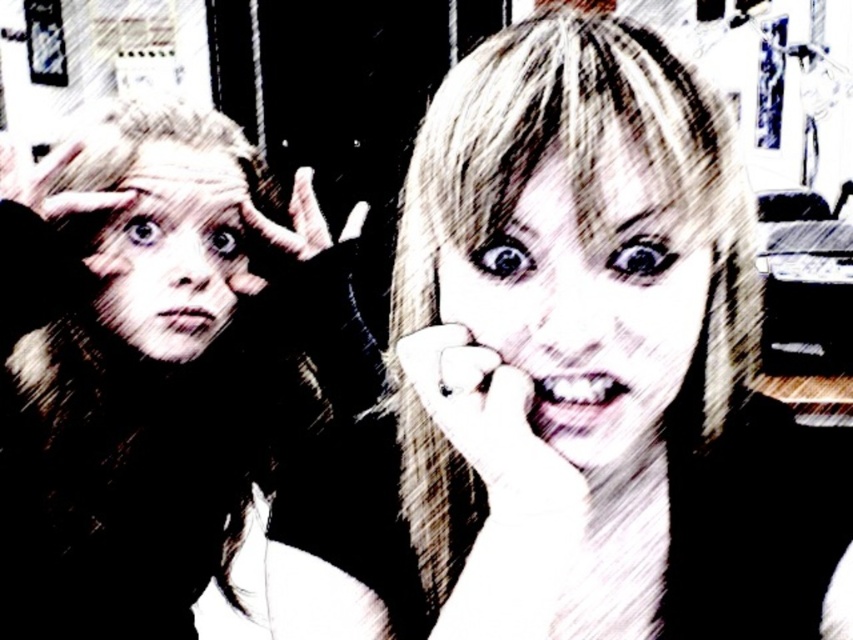
Does white matte hand at center have a greater height compared to matte black hand at upper left?

Incorrect, white matte hand at center's height is not larger of matte black hand at upper left's.

The height and width of the screenshot is (640, 853). What do you see at coordinates (491, 426) in the screenshot? I see `white matte hand at center` at bounding box center [491, 426].

Locate an element on the screen. white matte hand at center is located at coordinates (491, 426).

Between matte black hand at upper left and black leather hand at center, which one is positioned lower?

black leather hand at center is lower down.

Between matte black hand at upper left and black leather hand at center, which one appears on the right side from the viewer's perspective?

black leather hand at center

Is point (22, 163) closer to viewer compared to point (252, 209)?

Yes, it is.

The width and height of the screenshot is (853, 640). I want to click on matte black hand at upper left, so click(48, 180).

Is matte black fur coat at left smaller than black leather hand at center?

Actually, matte black fur coat at left might be larger than black leather hand at center.

Is the position of matte black fur coat at left more distant than that of black leather hand at center?

No, it is in front of black leather hand at center.

Measure the distance between point [172,108] and camera.

The distance of point [172,108] from camera is 36.79 inches.

Find the location of a particular element. The height and width of the screenshot is (640, 853). matte black fur coat at left is located at coordinates (143, 365).